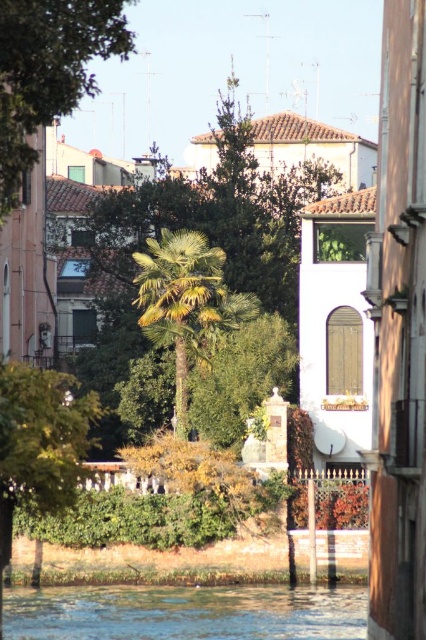
Between green leafy tree at lower left and green leafy palm tree at center, which one appears on the right side from the viewer's perspective?

green leafy palm tree at center

Consider the image. Does green leafy tree at lower left have a lesser height compared to green leafy palm tree at center?

No.

Locate an element on the screen. This screenshot has height=640, width=426. green leafy tree at lower left is located at coordinates (40, 444).

Based on the photo, who is lower down, green leafy tree at center or green leafy palm tree at center?

Positioned lower is green leafy palm tree at center.

Does point (239, 198) come in front of point (204, 323)?

That is False.

Which is behind, point (288, 220) or point (138, 300)?

The point (288, 220) is more distant.

This screenshot has width=426, height=640. I want to click on green leafy tree at center, so click(210, 243).

Does green leafy tree at center have a larger size compared to clear water at lower center?

Yes, green leafy tree at center is bigger than clear water at lower center.

The image size is (426, 640). Identify the location of green leafy tree at center. (210, 243).

Is point (278, 220) in front of point (72, 630)?

No, (278, 220) is further to viewer.

Image resolution: width=426 pixels, height=640 pixels. I want to click on green leafy tree at center, so click(210, 243).